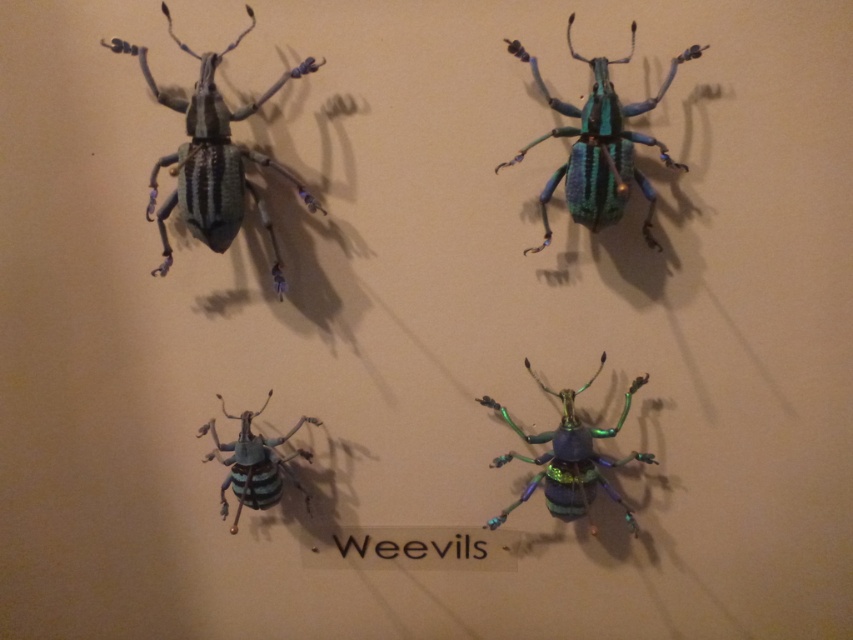
Question: Which object appears closest to the camera in this image?

Choices:
 (A) metallic iridescent weevil at center
 (B) matte green beetle at center

Answer: (A)

Question: Can you confirm if matte black beetle at upper left is wider than metallic blue-green beetle at upper center?

Choices:
 (A) no
 (B) yes

Answer: (B)

Question: Among these points, which one is nearest to the camera?

Choices:
 (A) (544, 442)
 (B) (601, 227)
 (C) (268, 221)

Answer: (B)

Question: Which is nearer to the metallic iridescent weevil at center?

Choices:
 (A) matte green beetle at center
 (B) matte black beetle at upper left
 (C) metallic blue-green beetle at upper center

Answer: (C)

Question: Does matte black beetle at upper left come behind metallic blue-green beetle at upper center?

Choices:
 (A) yes
 (B) no

Answer: (B)

Question: Is matte black beetle at upper left closer to the viewer compared to matte green beetle at center?

Choices:
 (A) no
 (B) yes

Answer: (B)